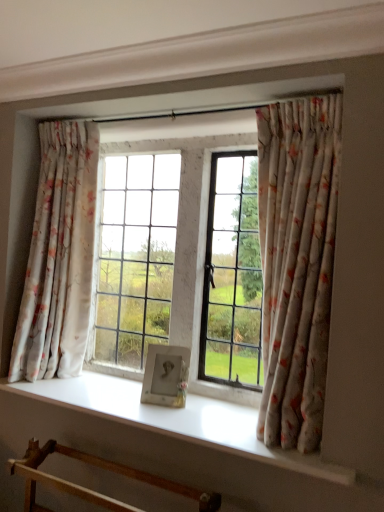
Question: Are wooden frame at lower left and floral fabric curtain at left, arranged as the 2th curtain when viewed from the front, beside each other?

Choices:
 (A) yes
 (B) no

Answer: (B)

Question: Is wooden frame at lower left located outside floral fabric curtain at left, arranged as the 2th curtain when viewed from the front?

Choices:
 (A) no
 (B) yes

Answer: (B)

Question: From the image's perspective, is wooden frame at lower left below floral fabric curtain at left, arranged as the 2th curtain when viewed from the front?

Choices:
 (A) yes
 (B) no

Answer: (A)

Question: Would you say floral fabric curtain at left, arranged as the 2th curtain when viewed from the front, is part of wooden frame at lower left's contents?

Choices:
 (A) yes
 (B) no

Answer: (B)

Question: Can you confirm if wooden frame at lower left is smaller than floral fabric curtain at left, arranged as the first curtain when viewed from the left?

Choices:
 (A) no
 (B) yes

Answer: (B)

Question: Does point (39, 253) appear closer or farther from the camera than point (34, 501)?

Choices:
 (A) closer
 (B) farther

Answer: (B)

Question: From the image's perspective, is floral fabric curtain at left, which ranks as the first curtain in back-to-front order, above or below wooden frame at lower left?

Choices:
 (A) above
 (B) below

Answer: (A)

Question: Is floral fabric curtain at left, arranged as the 2th curtain when viewed from the front, wider or thinner than wooden frame at lower left?

Choices:
 (A) thin
 (B) wide

Answer: (A)

Question: Would you say floral fabric curtain at left, which appears as the second curtain when viewed from the right, is to the left or to the right of wooden frame at lower left in the picture?

Choices:
 (A) right
 (B) left

Answer: (B)

Question: Looking at their shapes, would you say floral fabric curtain at right, which ranks as the 2th curtain in left-to-right order, is wider or thinner than white smooth window sill at center?

Choices:
 (A) wide
 (B) thin

Answer: (B)

Question: Based on their sizes in the image, would you say floral fabric curtain at right, marked as the first curtain in a right-to-left arrangement, is bigger or smaller than white smooth window sill at center?

Choices:
 (A) small
 (B) big

Answer: (B)

Question: In the image, is floral fabric curtain at right, marked as the first curtain in a right-to-left arrangement, on the left side or the right side of white smooth window sill at center?

Choices:
 (A) left
 (B) right

Answer: (B)

Question: Is point (279, 317) positioned closer to the camera than point (109, 392)?

Choices:
 (A) farther
 (B) closer

Answer: (B)

Question: In terms of width, does white smooth window sill at center look wider or thinner when compared to floral fabric curtain at right, the first curtain from the front?

Choices:
 (A) thin
 (B) wide

Answer: (B)

Question: In terms of height, does white smooth window sill at center look taller or shorter compared to floral fabric curtain at right, the first curtain from the front?

Choices:
 (A) short
 (B) tall

Answer: (A)